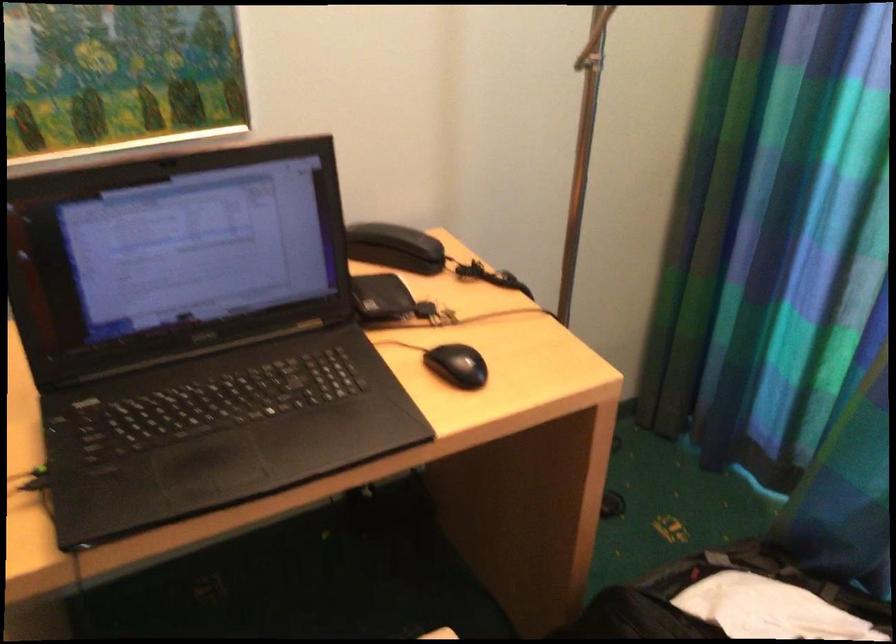
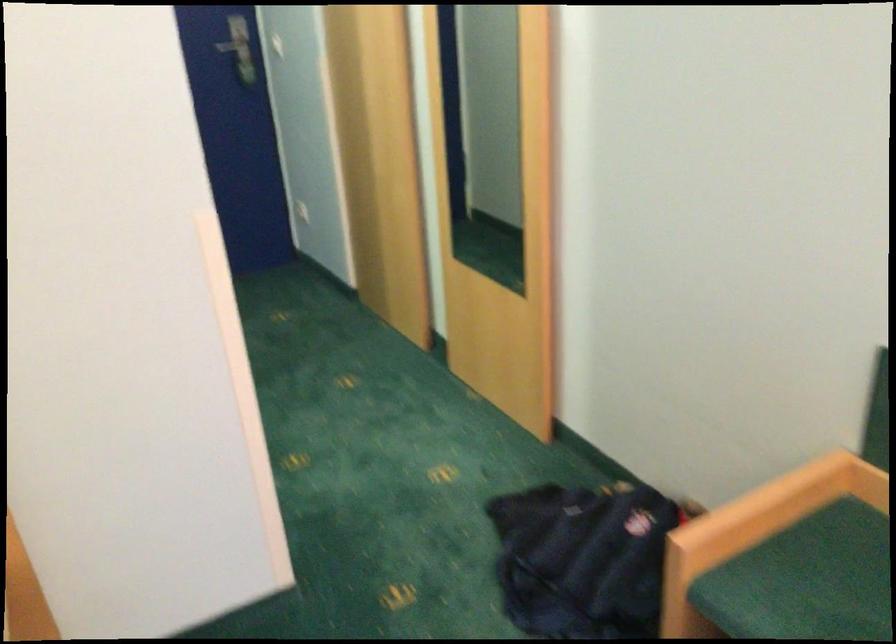
The first image is from the beginning of the video and the second image is from the end. How did the camera likely rotate when shooting the video?

The rotation direction of the camera is left-down.